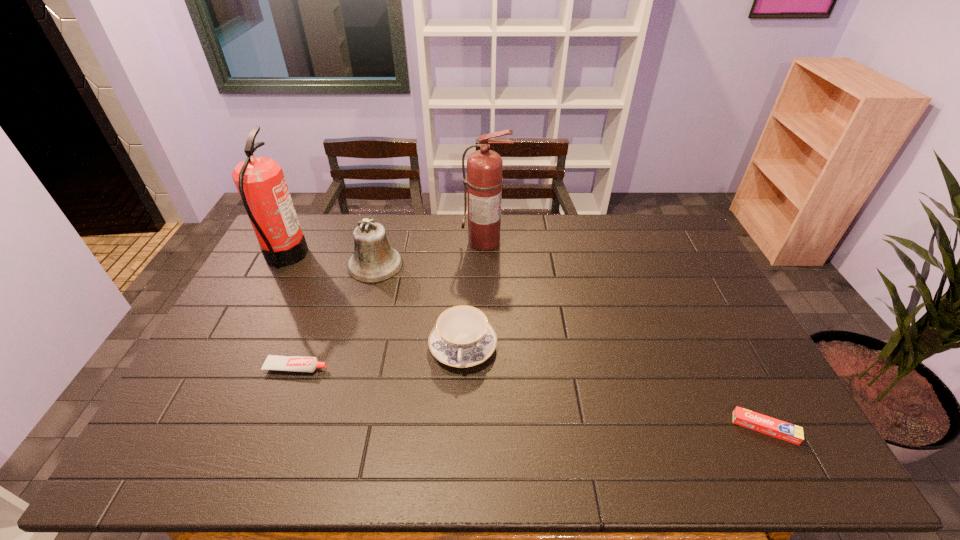
Where is `the leftmost object`? the leftmost object is located at coordinates (261, 184).

Where is `the right fire extinguisher`? This screenshot has width=960, height=540. the right fire extinguisher is located at coordinates (484, 180).

Locate an element on the screen. Image resolution: width=960 pixels, height=540 pixels. the fourth shortest object is located at coordinates (373, 261).

Identify the location of chinaware. (462, 337).

At what (x,y) coordinates should I click in order to perform the action: click on the taller toothpaste. Please return your answer as a coordinate pair (x, y). Looking at the image, I should click on (273, 362).

This screenshot has height=540, width=960. What are the coordinates of `the farther toothpaste` in the screenshot? It's located at (273, 362).

The height and width of the screenshot is (540, 960). Find the location of `the shortest object`. the shortest object is located at coordinates (792, 433).

At what (x,y) coordinates should I click in order to perform the action: click on the rightmost object. Please return your answer as a coordinate pair (x, y). Looking at the image, I should click on pos(792,433).

Image resolution: width=960 pixels, height=540 pixels. What are the coordinates of `free spot located on the front side of the leftmost object` in the screenshot? It's located at (403, 256).

Image resolution: width=960 pixels, height=540 pixels. Find the location of `free space located 0.220m on the front-facing side of the right fire extinguisher`. free space located 0.220m on the front-facing side of the right fire extinguisher is located at coordinates (486, 295).